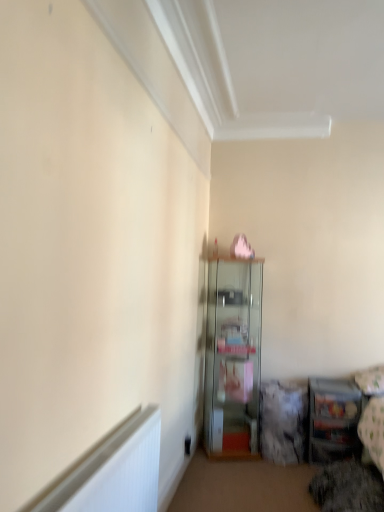
Question: Is clear glass cabinet at center, the 2th shelf in the right-to-left sequence, at the right side of metallic glass shelf at lower right, which ranks as the 2th shelf in left-to-right order?

Choices:
 (A) no
 (B) yes

Answer: (A)

Question: Is metallic glass shelf at lower right, which appears as the 1th shelf when viewed from the right, surrounded by clear glass cabinet at center, the 2th shelf in the right-to-left sequence?

Choices:
 (A) yes
 (B) no

Answer: (B)

Question: Can you confirm if clear glass cabinet at center, which is counted as the 1th shelf, starting from the left, is smaller than metallic glass shelf at lower right, which appears as the 1th shelf when viewed from the right?

Choices:
 (A) yes
 (B) no

Answer: (B)

Question: Can you confirm if clear glass cabinet at center, the 2th shelf in the right-to-left sequence, is taller than metallic glass shelf at lower right, which appears as the 1th shelf when viewed from the right?

Choices:
 (A) yes
 (B) no

Answer: (A)

Question: Can you confirm if clear glass cabinet at center, the 2th shelf in the right-to-left sequence, is bigger than metallic glass shelf at lower right, which ranks as the 2th shelf in left-to-right order?

Choices:
 (A) yes
 (B) no

Answer: (A)

Question: Is clear glass cabinet at center, the 2th shelf in the right-to-left sequence, wider than metallic glass shelf at lower right, which appears as the 1th shelf when viewed from the right?

Choices:
 (A) no
 (B) yes

Answer: (B)

Question: Is the depth of metallic glass shelf at lower right, which ranks as the 2th shelf in left-to-right order, greater than that of clear glass cabinet at center, the 2th shelf in the right-to-left sequence?

Choices:
 (A) no
 (B) yes

Answer: (A)

Question: Can you confirm if metallic glass shelf at lower right, which ranks as the 2th shelf in left-to-right order, is positioned to the left of clear glass cabinet at center, the 2th shelf in the right-to-left sequence?

Choices:
 (A) no
 (B) yes

Answer: (A)

Question: Is metallic glass shelf at lower right, which ranks as the 2th shelf in left-to-right order, shorter than clear glass cabinet at center, which is counted as the 1th shelf, starting from the left?

Choices:
 (A) yes
 (B) no

Answer: (A)

Question: From a real-world perspective, is metallic glass shelf at lower right, which appears as the 1th shelf when viewed from the right, on top of clear glass cabinet at center, the 2th shelf in the right-to-left sequence?

Choices:
 (A) yes
 (B) no

Answer: (B)

Question: Is metallic glass shelf at lower right, which appears as the 1th shelf when viewed from the right, in contact with clear glass cabinet at center, the 2th shelf in the right-to-left sequence?

Choices:
 (A) yes
 (B) no

Answer: (B)

Question: From the image's perspective, does metallic glass shelf at lower right, which appears as the 1th shelf when viewed from the right, appear higher than clear glass cabinet at center, which is counted as the 1th shelf, starting from the left?

Choices:
 (A) no
 (B) yes

Answer: (A)

Question: Relative to clear glass cabinet at center, the 2th shelf in the right-to-left sequence, is metallic glass shelf at lower right, which appears as the 1th shelf when viewed from the right, in front or behind?

Choices:
 (A) front
 (B) behind

Answer: (A)